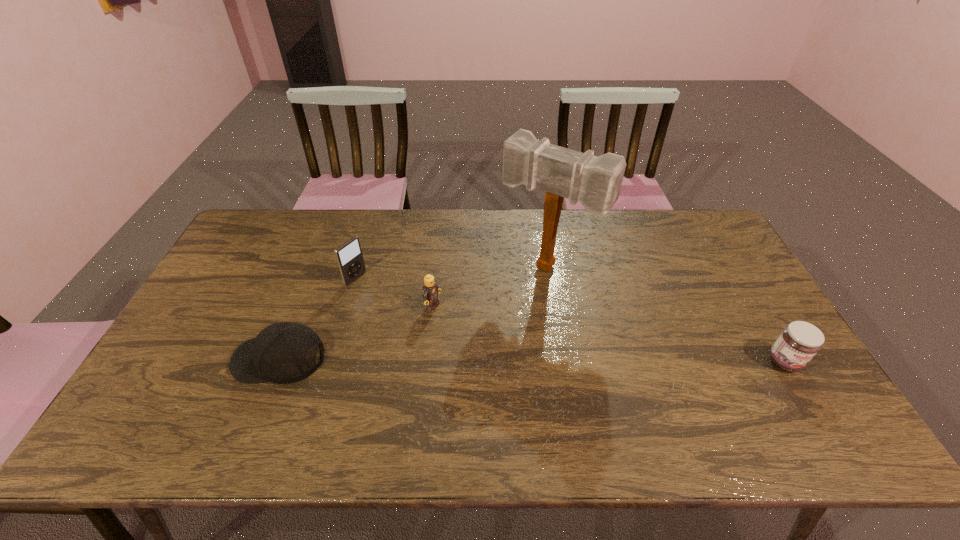
This screenshot has height=540, width=960. I want to click on vacant area in the image that satisfies the following two spatial constraints: 1. on the front side of the third object from right to left; 2. on the left side of the second tallest object, so click(x=348, y=306).